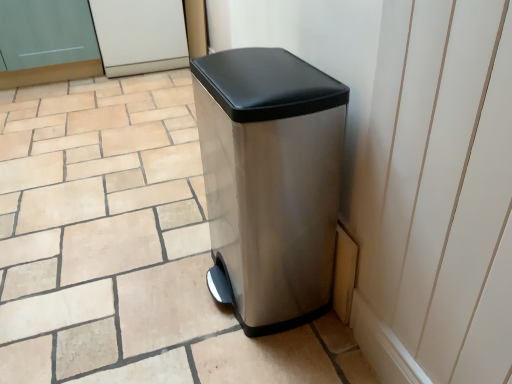
Question: Is white glossy screen door at upper center, which ranks as the first screen door in right-to-left order, shorter than stainless steel trash can at center?

Choices:
 (A) no
 (B) yes

Answer: (B)

Question: Could stainless steel trash can at center be considered to be inside white glossy screen door at upper center, which ranks as the first screen door in right-to-left order?

Choices:
 (A) no
 (B) yes

Answer: (A)

Question: Can you confirm if white glossy screen door at upper center, which ranks as the first screen door in right-to-left order, is taller than stainless steel trash can at center?

Choices:
 (A) no
 (B) yes

Answer: (A)

Question: Does white glossy screen door at upper center, which ranks as the first screen door in right-to-left order, have a larger size compared to stainless steel trash can at center?

Choices:
 (A) no
 (B) yes

Answer: (B)

Question: From a real-world perspective, is white glossy screen door at upper center, positioned as the second screen door in left-to-right order, located higher than stainless steel trash can at center?

Choices:
 (A) no
 (B) yes

Answer: (A)

Question: Is stainless steel trash can at center situated inside matte glass screen door at upper left, which is the 2th screen door in right-to-left order, or outside?

Choices:
 (A) inside
 (B) outside

Answer: (B)

Question: From the image's perspective, relative to matte glass screen door at upper left, which is the 2th screen door in right-to-left order, is stainless steel trash can at center above or below?

Choices:
 (A) above
 (B) below

Answer: (B)

Question: Relative to matte glass screen door at upper left, which is counted as the first screen door, starting from the left, is stainless steel trash can at center in front or behind?

Choices:
 (A) front
 (B) behind

Answer: (A)

Question: Does point (331, 97) appear closer or farther from the camera than point (13, 56)?

Choices:
 (A) closer
 (B) farther

Answer: (A)

Question: From the image's perspective, is matte glass screen door at upper left, which is counted as the first screen door, starting from the left, located above or below stainless steel trash can at center?

Choices:
 (A) below
 (B) above

Answer: (B)

Question: From a real-world perspective, relative to stainless steel trash can at center, is matte glass screen door at upper left, which is the 2th screen door in right-to-left order, vertically above or below?

Choices:
 (A) below
 (B) above

Answer: (A)

Question: Is matte glass screen door at upper left, which is the 2th screen door in right-to-left order, taller or shorter than stainless steel trash can at center?

Choices:
 (A) short
 (B) tall

Answer: (A)

Question: Is matte glass screen door at upper left, which is the 2th screen door in right-to-left order, wider or thinner than stainless steel trash can at center?

Choices:
 (A) thin
 (B) wide

Answer: (B)

Question: In terms of height, does matte glass screen door at upper left, which is counted as the first screen door, starting from the left, look taller or shorter compared to white glossy screen door at upper center, which ranks as the first screen door in right-to-left order?

Choices:
 (A) short
 (B) tall

Answer: (B)

Question: In the image, is matte glass screen door at upper left, which is the 2th screen door in right-to-left order, positioned in front of or behind white glossy screen door at upper center, positioned as the second screen door in left-to-right order?

Choices:
 (A) behind
 (B) front

Answer: (B)